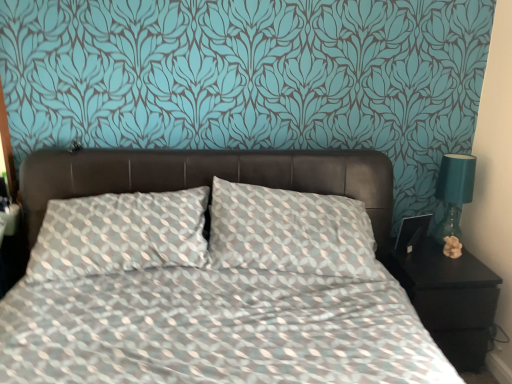
The height and width of the screenshot is (384, 512). In order to click on free space in front of matte beige figurine at right in this screenshot , I will do `click(451, 274)`.